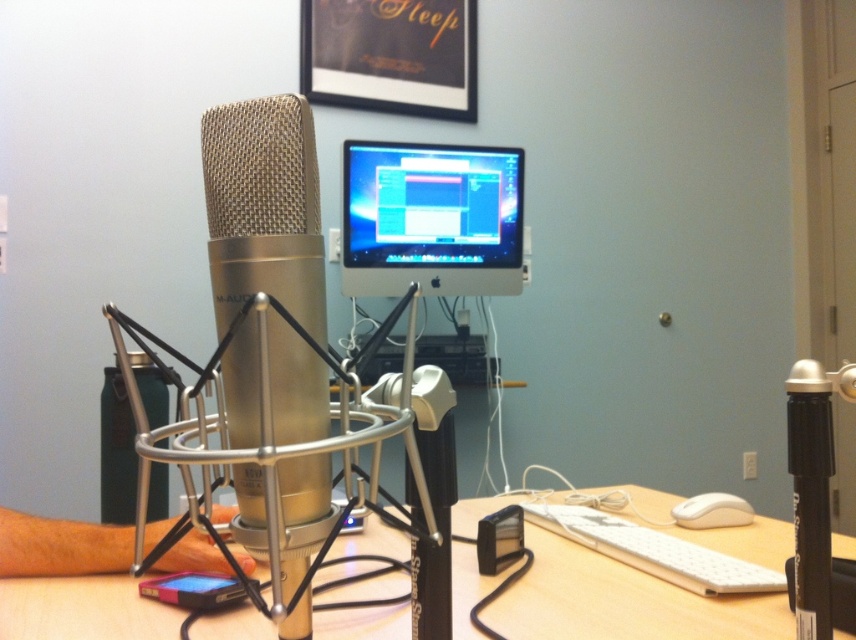
Question: Is white plastic keyboard at center to the left of matte black monitor at center from the viewer's perspective?

Choices:
 (A) yes
 (B) no

Answer: (B)

Question: Which is farther from the matte black monitor at center?

Choices:
 (A) white plastic keyboard at lower center
 (B) silver/metallic/mesh microphone at center

Answer: (B)

Question: Which object is farther from the camera taking this photo?

Choices:
 (A) white plastic keyboard at center
 (B) white plastic keyboard at lower center
 (C) silver/metallic/mesh microphone at center
 (D) matte black monitor at center

Answer: (D)

Question: Does matte black monitor at center have a lesser width compared to white plastic keyboard at lower center?

Choices:
 (A) yes
 (B) no

Answer: (B)

Question: Estimate the real-world distances between objects in this image. Which object is farther from the white plastic keyboard at center?

Choices:
 (A) white plastic keyboard at lower center
 (B) silver/metallic/mesh microphone at center

Answer: (B)

Question: Does white plastic keyboard at center appear over silver/metallic/mesh microphone at center?

Choices:
 (A) yes
 (B) no

Answer: (B)